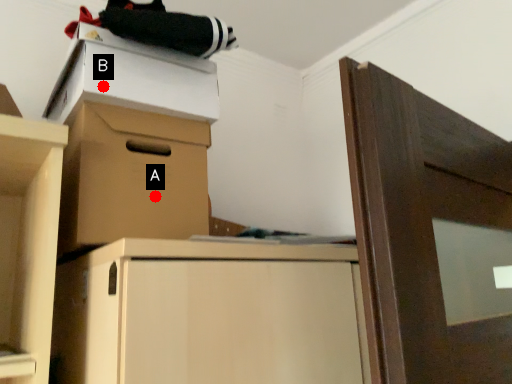
Question: Two points are circled on the image, labeled by A and B beside each circle. Which point is closer to the camera?

Choices:
 (A) A is closer
 (B) B is closer

Answer: (B)